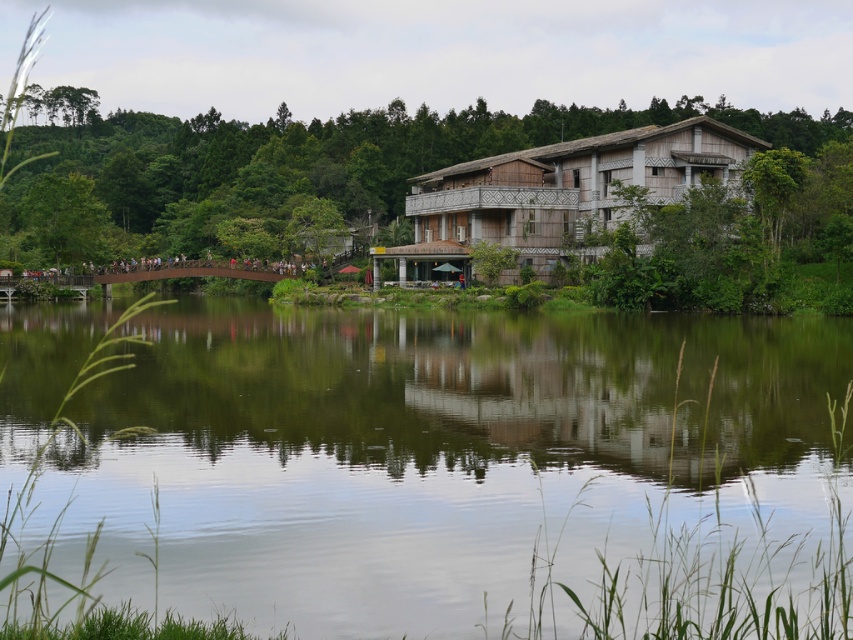
You are standing on the lakeside path and want to take a photo of both the green reflective water at center and the wooden hut at center. Which object should you position closer to the camera to include both in the frame?

The wooden hut at center is above the green reflective water at center, so you should position the camera closer to the wooden hut at center to include both in the frame.

You are standing at the lakeside and want to take a photo of both the green reflective water at center and the wooden hut at center. Which object should you focus on first if you want to capture both in one frame without moving your camera?

You should focus on the wooden hut at center first because it is taller than the green reflective water at center, allowing you to adjust the camera angle to include both in the frame.

You are planning to place a small boat in the scene. The boat requires a water area wider than the wooden hut at center. Can the green reflective water at center accommodate the boat?

The green reflective water at center is wider than the wooden hut at center, so yes, the boat can be placed there as it meets the required width.